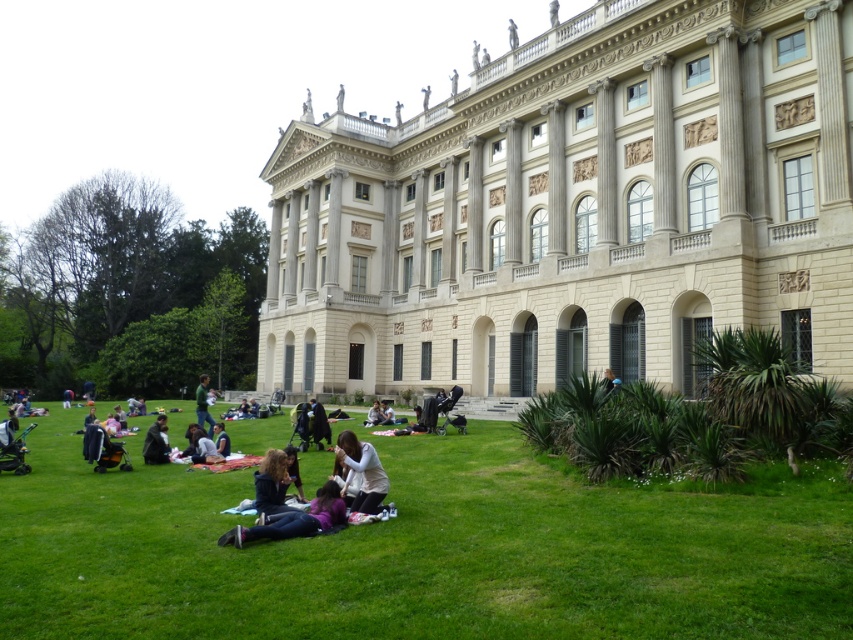
You are a photographer planning to take a picture of the light gray fabric at center from a specific angle. The coordinates given are in the normalized image coordinate system where the origin is at the bottom left corner. If you want to position the camera directly above the fabric, what coordinates should you aim for?

The light gray fabric at center is located at coordinates point (204,449). To position the camera directly above it, aim for the same coordinates, which would be point (204,449).

You are standing at the entrance of the classical building and want to find the dark blue jeans at lower center. According to the coordinates given, in which direction should you look to locate them?

The dark blue jeans at lower center is located at coordinates point (294, 518). Since the coordinate system is normalized, the x value 0.812 indicates it is to the right side and the y value 0.347 indicates it is slightly below the center. Therefore, you should look towards the lower right direction to locate them.

You are standing in front of the classical building and want to determine the relative positions of two points marked on the lawn. Which point is closer to you, point (212, 442) or point (312, 422)?

Point (212, 442) is closer to the viewer than point (312, 422).